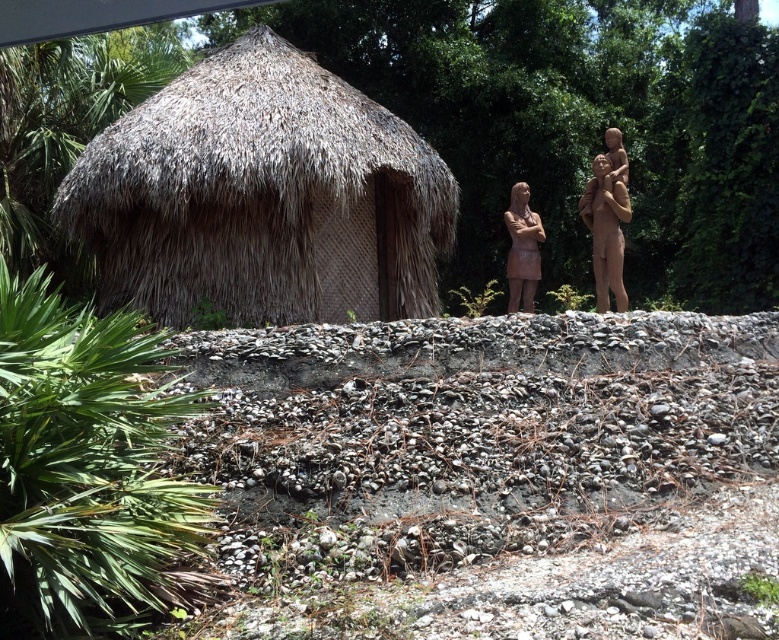
The height and width of the screenshot is (640, 779). What do you see at coordinates (261, 196) in the screenshot? I see `thatched straw hut at left` at bounding box center [261, 196].

Is point (400, 147) less distant than point (629, 216)?

No.

Is point (404, 205) less distant than point (608, 262)?

No, it is behind (608, 262).

This screenshot has height=640, width=779. Identify the location of thatched straw hut at left. (261, 196).

Is point (605, 284) farther from camera compared to point (513, 252)?

No.

Based on the photo, between brown matte statue at right and matte bronze statue at center, which one is positioned lower?

Positioned lower is brown matte statue at right.

Find the location of a particular element. This screenshot has width=779, height=640. brown matte statue at right is located at coordinates (605, 230).

Does thatched straw hut at left have a lesser width compared to matte bronze statue at center?

In fact, thatched straw hut at left might be wider than matte bronze statue at center.

Based on the photo, measure the distance between thatched straw hut at left and matte bronze statue at center.

3.36 meters

I want to click on thatched straw hut at left, so click(261, 196).